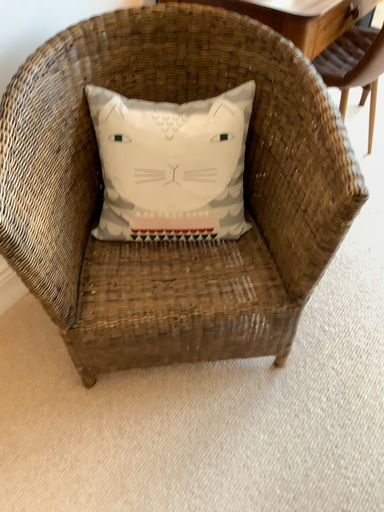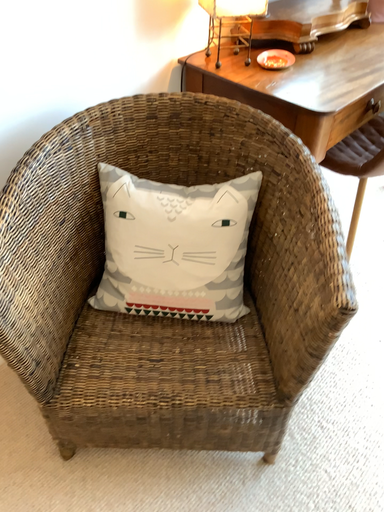
Question: How did the camera likely rotate when shooting the video?

Choices:
 (A) rotated upward
 (B) rotated downward

Answer: (A)